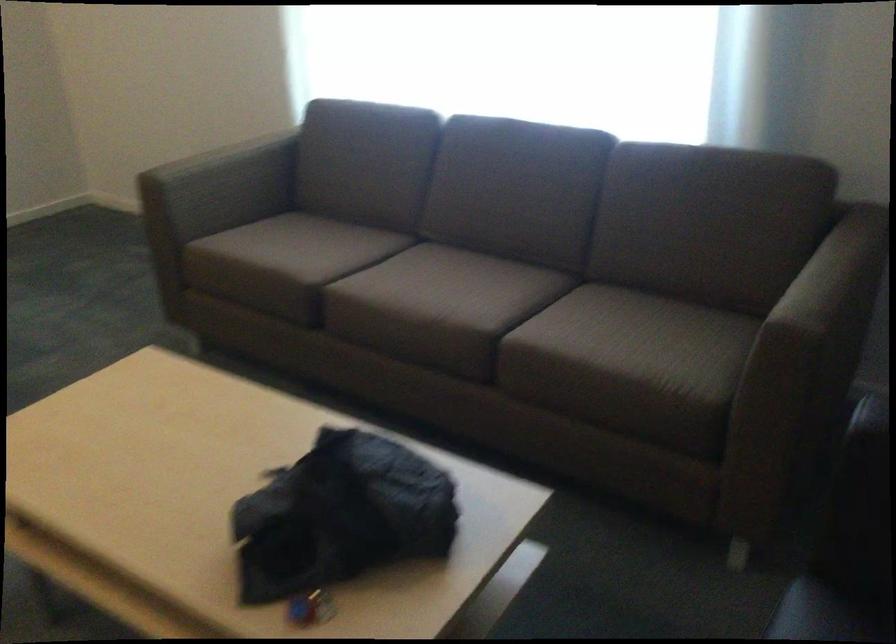
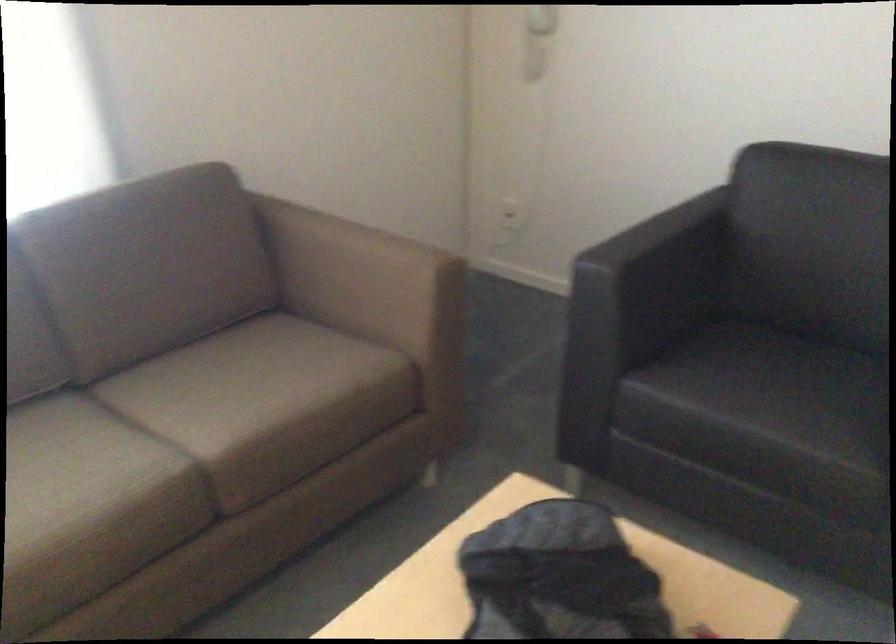
Where in the second image is the point corresponding to (x=307, y=465) from the first image?

(558, 576)